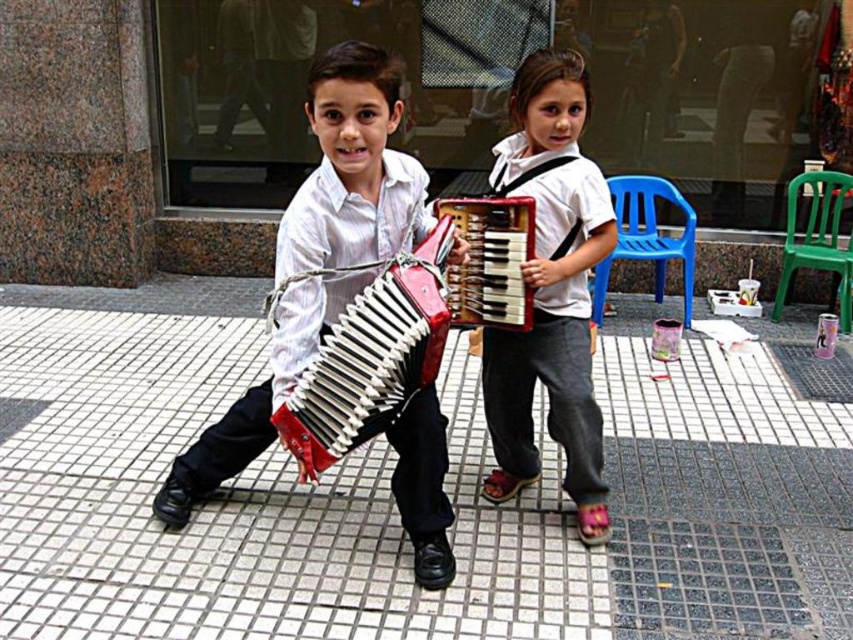
Does matte black accordion at center have a lesser height compared to white cotton shirt at center?

Yes.

Can you confirm if matte black accordion at center is positioned above white cotton shirt at center?

No.

You are a GUI agent. You are given a task and a screenshot of the screen. Output one action in this format:
    pyautogui.click(x=<x>, y=<y>)
    Task: Click on the matte black accordion at center
    
    Given the screenshot: What is the action you would take?
    pyautogui.click(x=352, y=168)

Is white cotton shirt at center below matte red accordion at center?

Actually, white cotton shirt at center is above matte red accordion at center.

What do you see at coordinates (550, 291) in the screenshot? I see `white cotton shirt at center` at bounding box center [550, 291].

Does point (538, 326) lie in front of point (361, 436)?

No, (538, 326) is further to viewer.

Locate an element on the screen. The width and height of the screenshot is (853, 640). white cotton shirt at center is located at coordinates tap(550, 291).

Who is higher up, white cotton shirt at center or red matte accordion at center?

red matte accordion at center is above.

The image size is (853, 640). I want to click on white cotton shirt at center, so click(550, 291).

Identify the location of white cotton shirt at center. The image size is (853, 640). (550, 291).